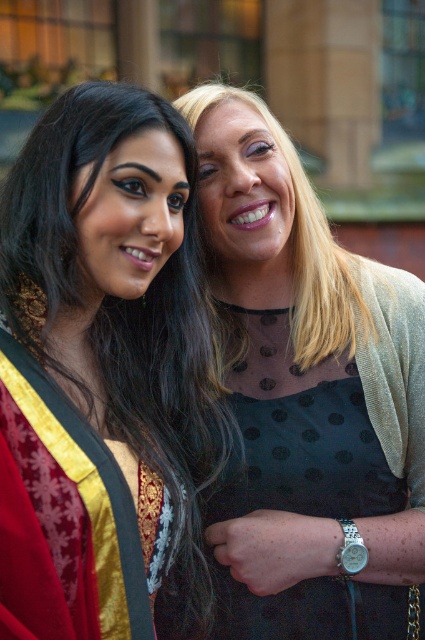
Does matte black dress at center appear under black dotted dress at center?

Incorrect, matte black dress at center is not positioned below black dotted dress at center.

Who is more distant from viewer, (62, 385) or (212, 214)?

Point (212, 214)

The image size is (425, 640). What are the coordinates of `matte black dress at center` in the screenshot? It's located at (102, 369).